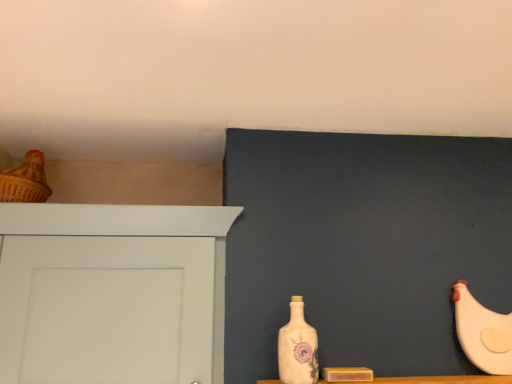
Question: From the image's perspective, does white matte chicken at right, marked as the second chicken in a left-to-right arrangement, appear higher than white painted wood door at left?

Choices:
 (A) no
 (B) yes

Answer: (A)

Question: Does white matte chicken at right, the 2th chicken in the top-to-bottom sequence, have a greater height compared to white painted wood door at left?

Choices:
 (A) no
 (B) yes

Answer: (A)

Question: Does white matte chicken at right, arranged as the first chicken when ordered from the bottom, lie behind white painted wood door at left?

Choices:
 (A) no
 (B) yes

Answer: (B)

Question: Are white matte chicken at right, marked as the second chicken in a left-to-right arrangement, and white painted wood door at left far apart?

Choices:
 (A) no
 (B) yes

Answer: (A)

Question: Would you say white matte chicken at right, arranged as the first chicken when ordered from the bottom, is outside white painted wood door at left?

Choices:
 (A) no
 (B) yes

Answer: (B)

Question: Can you confirm if white matte chicken at right, the 2th chicken in the top-to-bottom sequence, is wider than white painted wood door at left?

Choices:
 (A) yes
 (B) no

Answer: (B)

Question: Are white painted wood door at left and white matte chicken at right, the 2th chicken in the top-to-bottom sequence, far apart?

Choices:
 (A) no
 (B) yes

Answer: (A)

Question: Is white painted wood door at left facing away from white matte chicken at right, marked as the second chicken in a left-to-right arrangement?

Choices:
 (A) no
 (B) yes

Answer: (A)

Question: From a real-world perspective, is white painted wood door at left on top of white matte chicken at right, arranged as the first chicken when ordered from the bottom?

Choices:
 (A) no
 (B) yes

Answer: (B)

Question: Can you confirm if white painted wood door at left is positioned to the left of white matte chicken at right, marked as the second chicken in a left-to-right arrangement?

Choices:
 (A) yes
 (B) no

Answer: (A)

Question: Is white painted wood door at left shorter than white matte chicken at right, the 2th chicken in the top-to-bottom sequence?

Choices:
 (A) yes
 (B) no

Answer: (B)

Question: Considering the relative sizes of white painted wood door at left and white matte chicken at right, which is the 1th chicken in right-to-left order, in the image provided, is white painted wood door at left thinner than white matte chicken at right, which is the 1th chicken in right-to-left order,?

Choices:
 (A) no
 (B) yes

Answer: (A)

Question: Is porcelain floral bottle at center far away from white matte chicken at right, which is the 1th chicken in right-to-left order?

Choices:
 (A) no
 (B) yes

Answer: (A)